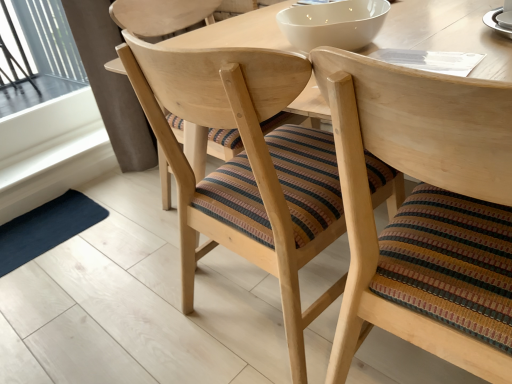
Where is `free point below wooden chair with striped cushion at center, arranged as the first chair when viewed from the left (from a real-world perspective)`? Image resolution: width=512 pixels, height=384 pixels. free point below wooden chair with striped cushion at center, arranged as the first chair when viewed from the left (from a real-world perspective) is located at coordinates (256, 311).